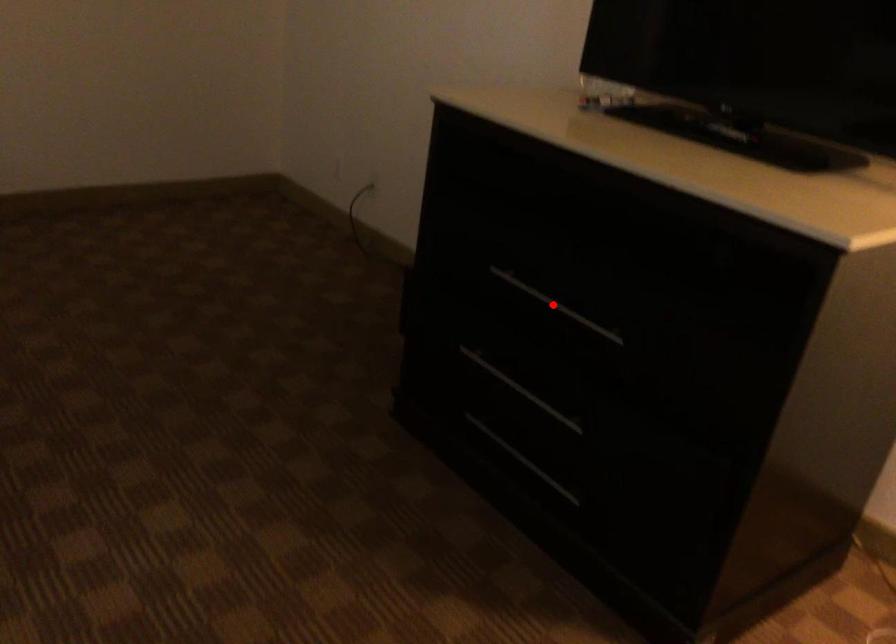
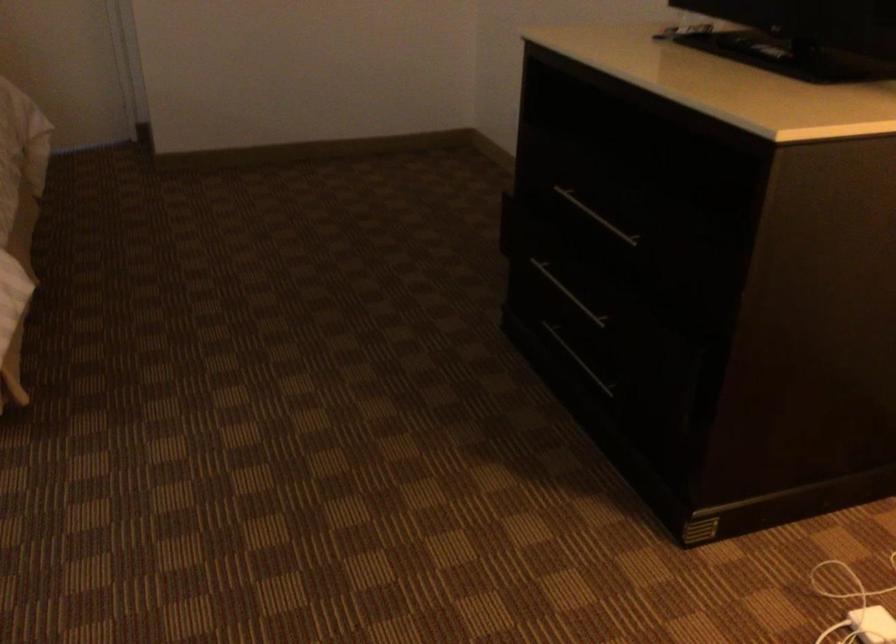
Question: A red point is marked in image1. In image2, is the corresponding 3D point closer to the camera or farther? Reply with the corresponding letter.

Choices:
 (A) The corresponding 3D point is closer.
 (B) The corresponding 3D point is farther.

Answer: (B)